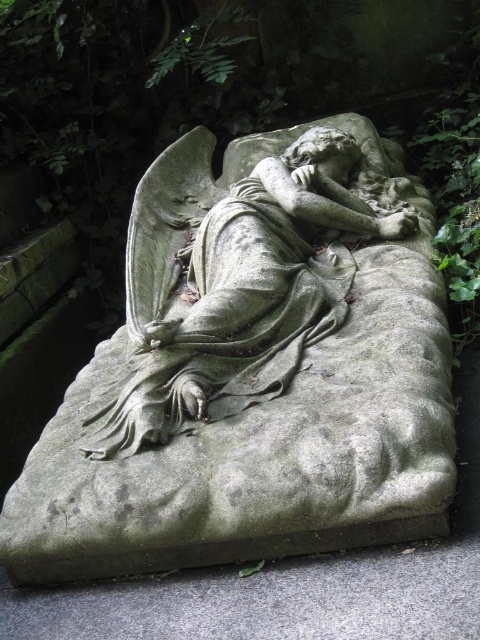
Consider the image. You are standing in a garden and see the gray stone angel at center and the gray stone bench at lower center. Which object is positioned more to the right side of the garden?

The gray stone angel at center is positioned to the right of the gray stone bench at lower center, so it is more to the right side of the garden.

Consider the image. You are an art conservator assessing the space between the gray stone angel at center and the gray stone bench at lower center. Given that the bench is wider, which object would you recommend placing a protective barrier around to prevent damage from foot traffic?

The gray stone angel at center has a lesser width compared to the gray stone bench at lower center, so the protective barrier should be placed around the gray stone angel at center to ensure it is safeguarded from foot traffic.

You are an art conservator examining the gray stone angel at center. Based on its weathered appearance and the presence of moss or lichen, what conservation concern might you prioritize?

The gray stone angel at center shows signs of weathering and biological growth like moss or lichen, so prioritizing the removal of organic material and addressing surface erosion would be important to prevent further deterioration.